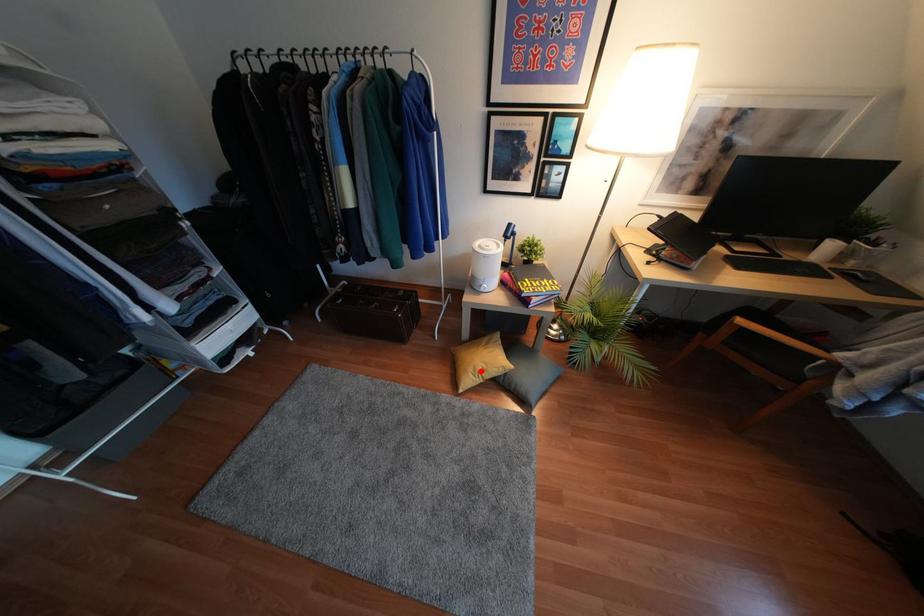
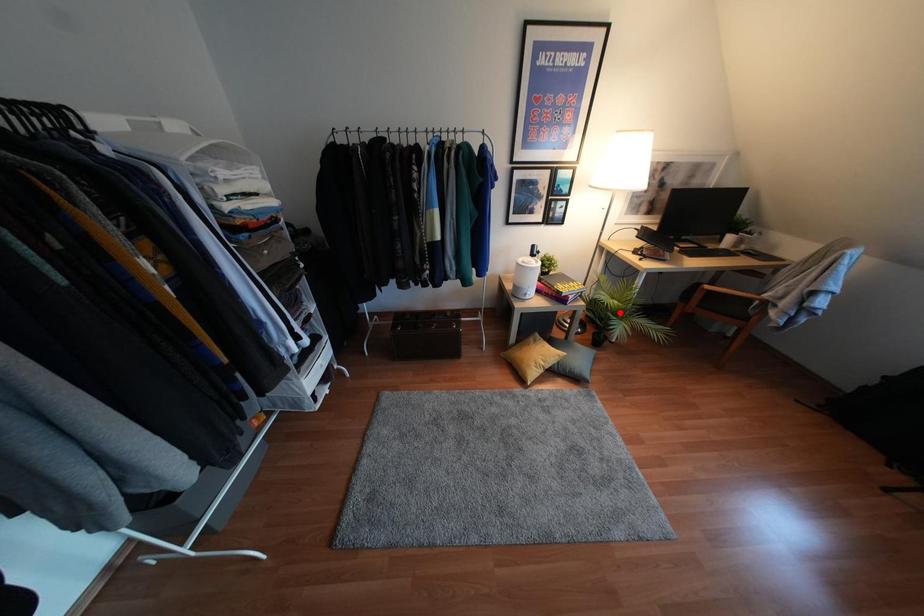
I am providing you with two images of the same scene from different viewpoints. A red point is marked on the first image and another point is marked on the second image. Do the highlighted points in image1 and image2 indicate the same real-world spot?

No